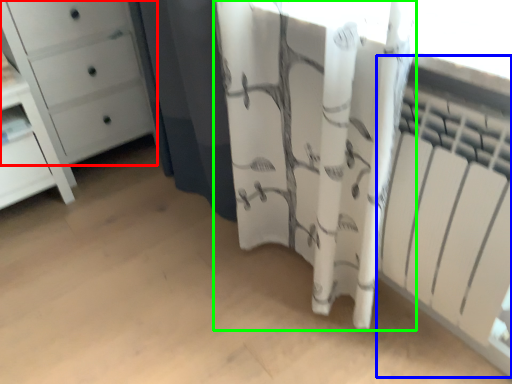
Question: Which object is positioned farthest from chest of drawers (highlighted by a red box)? Select from radiator (highlighted by a blue box) and curtain (highlighted by a green box).

Choices:
 (A) radiator
 (B) curtain

Answer: (A)